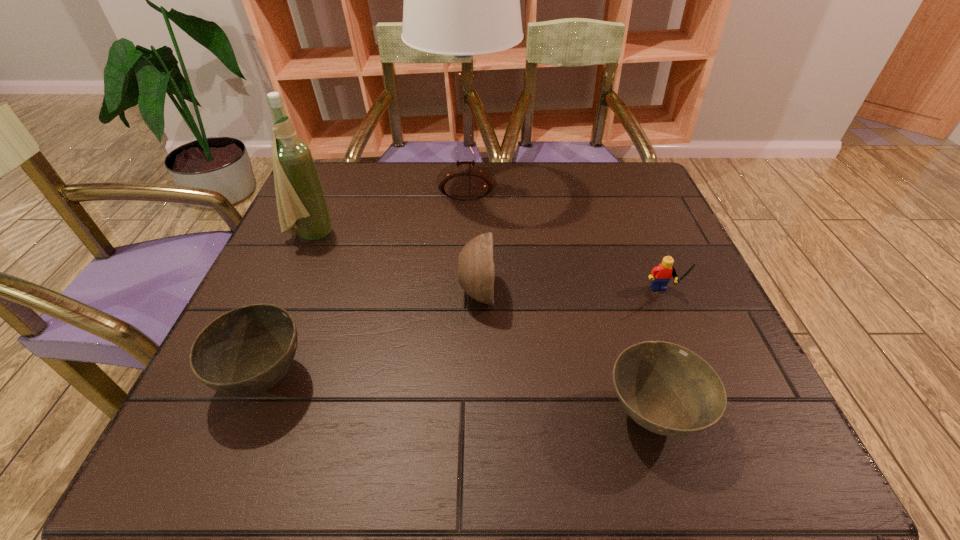
Find the location of a particular element. vacant space located on the front-facing side of the second tallest object is located at coordinates (424, 235).

Where is `vacant space situated 0.290m on the back of the tallest bowl`? The width and height of the screenshot is (960, 540). vacant space situated 0.290m on the back of the tallest bowl is located at coordinates (477, 198).

This screenshot has height=540, width=960. What are the coordinates of `free point located 0.330m on the front-facing side of the Lego` in the screenshot? It's located at (732, 469).

What are the coordinates of `blank area located 0.220m on the right of the leftmost bowl` in the screenshot? It's located at (435, 379).

Find the location of `free location located 0.060m on the left of the rightmost bowl`. free location located 0.060m on the left of the rightmost bowl is located at coordinates (566, 415).

At what (x,y) coordinates should I click in order to perform the action: click on object positioned at the far edge. Please return your answer as a coordinate pair (x, y). This screenshot has height=540, width=960. Looking at the image, I should click on (462, 0).

Locate an element on the screen. This screenshot has width=960, height=540. wine bottle that is at the left edge is located at coordinates (300, 199).

Find the location of a particular element. This screenshot has height=540, width=960. bowl located at the left edge is located at coordinates (247, 350).

Identify the location of Lego positioned at the right edge. The width and height of the screenshot is (960, 540). (660, 275).

This screenshot has width=960, height=540. In order to click on bowl present at the right edge in this screenshot , I will do `click(667, 389)`.